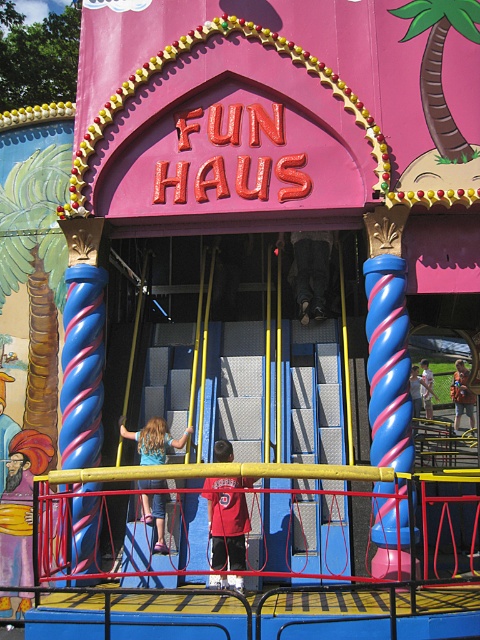
You are a costume designer preparing for a photo shoot at the entrance of the FUN HAUS ride. You need to ensure that the clothing items are visible in the photos. Which clothing item, the red shirt at center or the blue denim shorts at center, has a smaller width and might require more attention to ensure visibility?

The red shirt at center has a lesser width compared to the blue denim shorts at center, so it might require more attention to ensure visibility.

You are a costume designer preparing for a photoshoot at the entrance of the FUN HAUS ride. You have two outfits to place at the center of the scene for the shoot. The outfits are the red shirt at center and the blue denim shorts at center. Which outfit should you choose if you want the one that takes up less space in the photo?

The red shirt at center occupies less space than the blue denim shorts at center, so you should choose the red shirt at center for the photoshoot.

You are standing at the entrance of the amusement ride and see a person wearing a red shirt at center and blue denim shorts at center. Which piece of clothing is nearer to you?

The red shirt at center is closer to the viewer than blue denim shorts at center, so the red shirt at center is nearer to you.